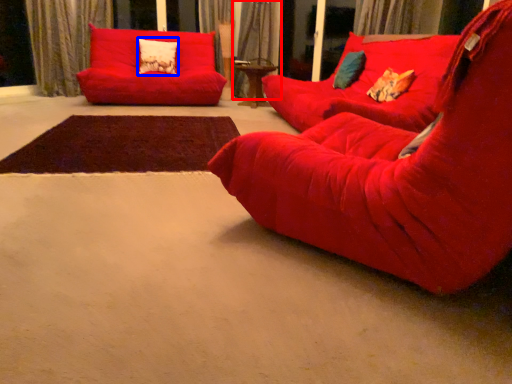
Question: Which point is closer to the camera, curtain (highlighted by a red box) or pillow (highlighted by a blue box)?

Choices:
 (A) curtain
 (B) pillow

Answer: (B)